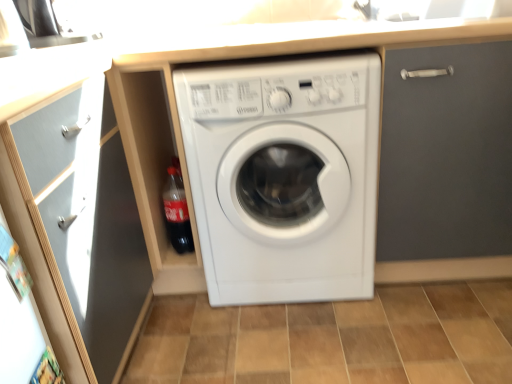
Question: Is translucent plastic bottle at lower left surrounding matte gray door at upper right?

Choices:
 (A) yes
 (B) no

Answer: (B)

Question: Can you confirm if translucent plastic bottle at lower left is positioned to the right of matte gray door at upper right?

Choices:
 (A) yes
 (B) no

Answer: (B)

Question: Can you confirm if translucent plastic bottle at lower left is shorter than matte gray door at upper right?

Choices:
 (A) no
 (B) yes

Answer: (B)

Question: Is translucent plastic bottle at lower left completely or partially outside of matte gray door at upper right?

Choices:
 (A) no
 (B) yes

Answer: (B)

Question: Does translucent plastic bottle at lower left come in front of matte gray door at upper right?

Choices:
 (A) yes
 (B) no

Answer: (B)

Question: In terms of size, does matte gray door at upper right appear bigger or smaller than translucent plastic bottle at lower left?

Choices:
 (A) small
 (B) big

Answer: (B)

Question: From their relative heights in the image, would you say matte gray door at upper right is taller or shorter than translucent plastic bottle at lower left?

Choices:
 (A) tall
 (B) short

Answer: (A)

Question: Considering the positions of point (470, 51) and point (167, 168), is point (470, 51) closer or farther from the camera than point (167, 168)?

Choices:
 (A) closer
 (B) farther

Answer: (A)

Question: From a real-world perspective, is matte gray door at upper right above or below translucent plastic bottle at lower left?

Choices:
 (A) above
 (B) below

Answer: (A)

Question: Considering the positions of matte gray door at upper right and brown tile at center in the image, is matte gray door at upper right taller or shorter than brown tile at center?

Choices:
 (A) short
 (B) tall

Answer: (B)

Question: From the image's perspective, is matte gray door at upper right located above or below brown tile at center?

Choices:
 (A) above
 (B) below

Answer: (A)

Question: Would you say matte gray door at upper right is inside or outside brown tile at center?

Choices:
 (A) inside
 (B) outside

Answer: (B)

Question: Looking at their shapes, would you say matte gray door at upper right is wider or thinner than brown tile at center?

Choices:
 (A) thin
 (B) wide

Answer: (B)

Question: In terms of height, does white plastic washing machine at center look taller or shorter compared to matte gray door at upper right?

Choices:
 (A) short
 (B) tall

Answer: (A)

Question: Does point (337, 147) appear closer or farther from the camera than point (472, 236)?

Choices:
 (A) closer
 (B) farther

Answer: (A)